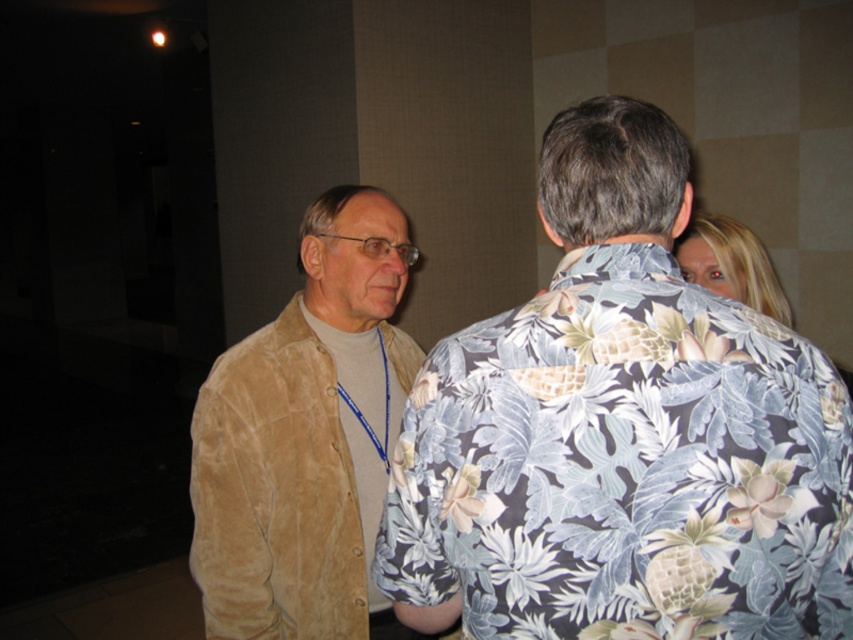
In the scene shown: Which is more to the left, floral print shirt at center or suede jacket at left?

suede jacket at left is more to the left.

Find the location of a particular element. floral print shirt at center is located at coordinates (621, 435).

Is suede jacket at left behind blonde hair at upper right?

No, suede jacket at left is in front of blonde hair at upper right.

Does suede jacket at left have a larger size compared to blonde hair at upper right?

Correct, suede jacket at left is larger in size than blonde hair at upper right.

Who is more distant from viewer, (x=242, y=397) or (x=787, y=316)?

Point (x=787, y=316)

Where is `suede jacket at left`? This screenshot has height=640, width=853. suede jacket at left is located at coordinates (305, 438).

Is floral print shirt at center further to the viewer compared to blonde hair at upper right?

No, it is in front of blonde hair at upper right.

Between floral print shirt at center and blonde hair at upper right, which one is positioned lower?

floral print shirt at center

Does point (749, 563) come in front of point (740, 257)?

Yes.

You are a GUI agent. You are given a task and a screenshot of the screen. Output one action in this format:
    pyautogui.click(x=<x>, y=<y>)
    Task: Click on the floral print shirt at center
    The width and height of the screenshot is (853, 640).
    Given the screenshot: What is the action you would take?
    pyautogui.click(x=621, y=435)